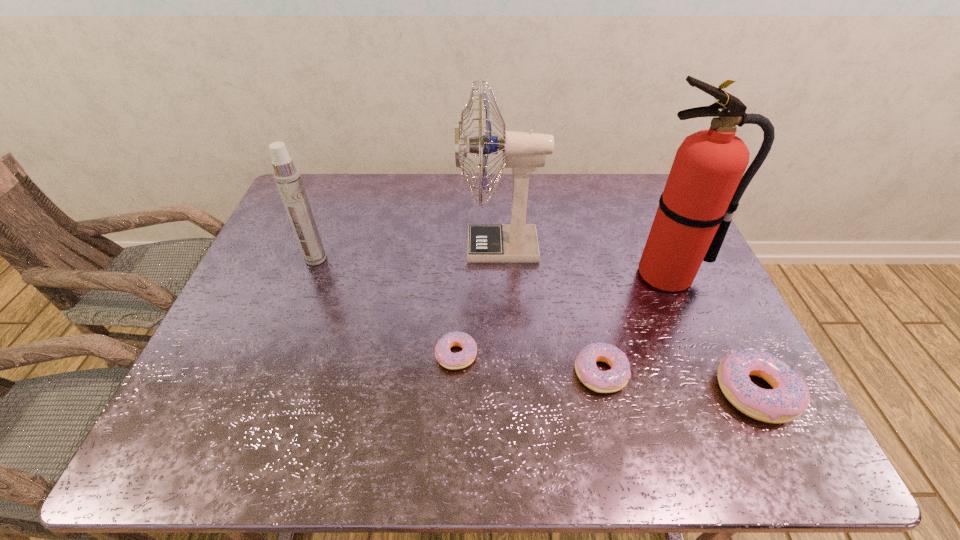
Find the location of a particular element. blank area located on the back of the shortest object is located at coordinates (462, 235).

Identify the location of free spot located 0.100m on the right of the third object from right to left. (672, 373).

Where is `vacant area situated on the left of the fourth tallest object`? vacant area situated on the left of the fourth tallest object is located at coordinates (684, 392).

Find the location of a particular element. This screenshot has width=960, height=540. free region located 0.140m at the nozzle of the fire extinguisher is located at coordinates (694, 338).

Image resolution: width=960 pixels, height=540 pixels. Identify the location of free region located on the front-facing side of the fan. (362, 247).

At what (x,y) coordinates should I click in order to perform the action: click on vacant region located on the front-facing side of the fan. Please return your answer as a coordinate pair (x, y). The width and height of the screenshot is (960, 540). Looking at the image, I should click on (410, 247).

Identify the location of vacant space located on the front-facing side of the fan. The image size is (960, 540). (430, 247).

Find the location of a particular element. The image size is (960, 540). vacant position located on the front of the leftmost object is located at coordinates (297, 309).

Where is `object that is at the left edge`? The width and height of the screenshot is (960, 540). object that is at the left edge is located at coordinates (287, 177).

Image resolution: width=960 pixels, height=540 pixels. I want to click on doughnut that is at the right edge, so pyautogui.click(x=789, y=398).